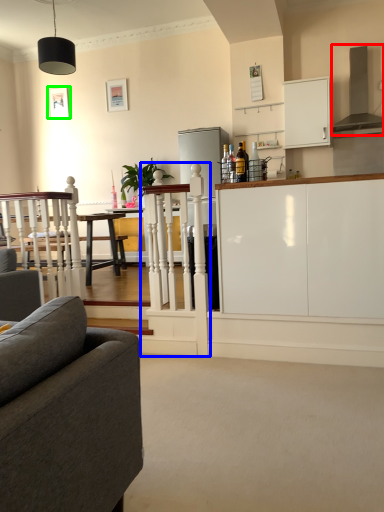
Question: Which object is the closest to the exhaust hood (highlighted by a red box)? Choose among these: rail (highlighted by a blue box) or picture frame (highlighted by a green box).

Choices:
 (A) rail
 (B) picture frame

Answer: (A)